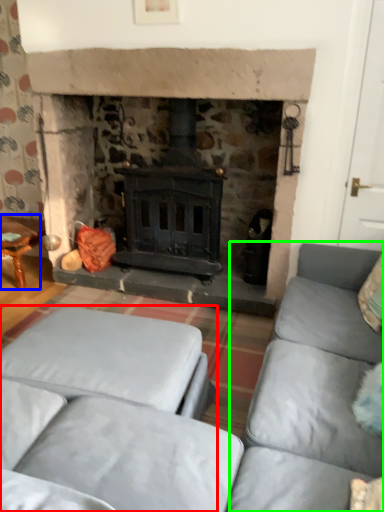
Question: Estimate the real-world distances between objects in this image. Which object is farther from studio couch (highlighted by a red box), table (highlighted by a blue box) or couch (highlighted by a green box)?

Choices:
 (A) table
 (B) couch

Answer: (A)